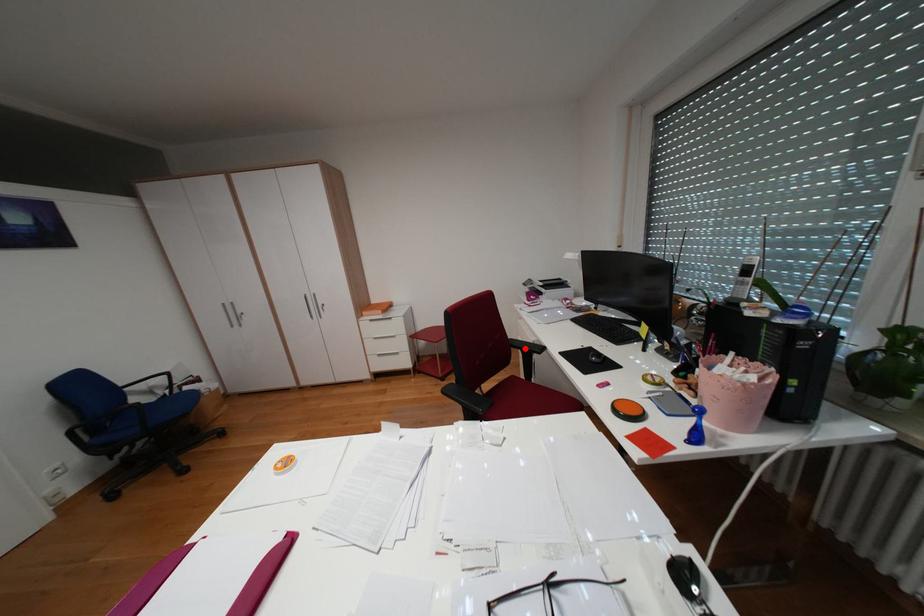
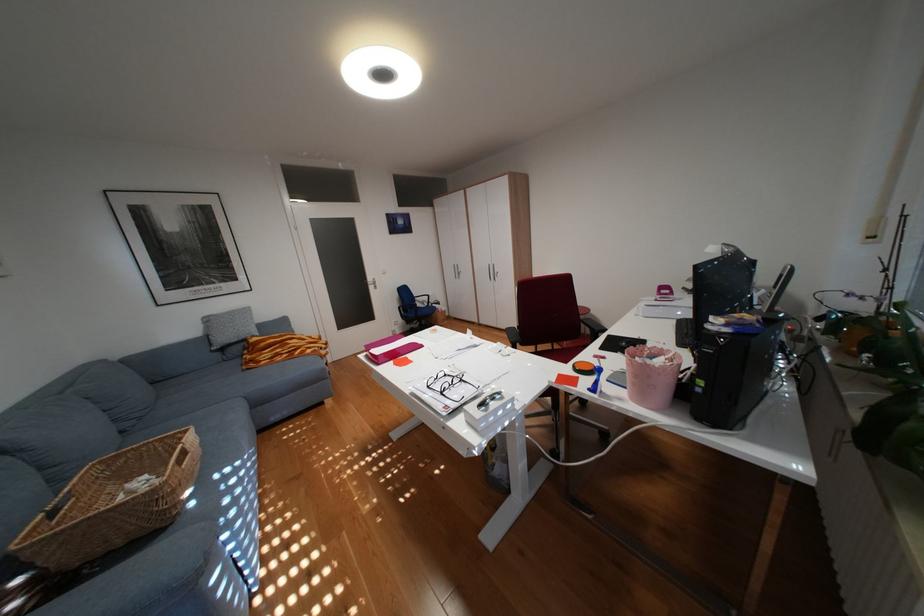
Where in the second image is the point corresponding to the highlighted location from the first image?

(594, 323)